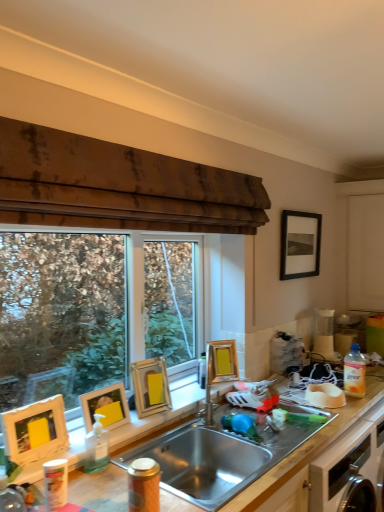
The height and width of the screenshot is (512, 384). Identify the location of free space above wooden cabinet at lower center (from a real-world perspective). (158, 407).